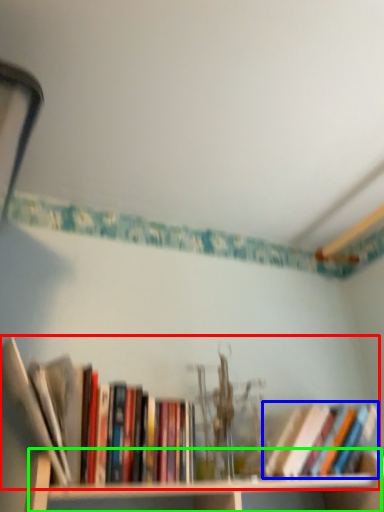
Question: Which is farther away from book (highlighted by a red box)? book (highlighted by a blue box) or cabinet (highlighted by a green box)?

Choices:
 (A) book
 (B) cabinet

Answer: (A)